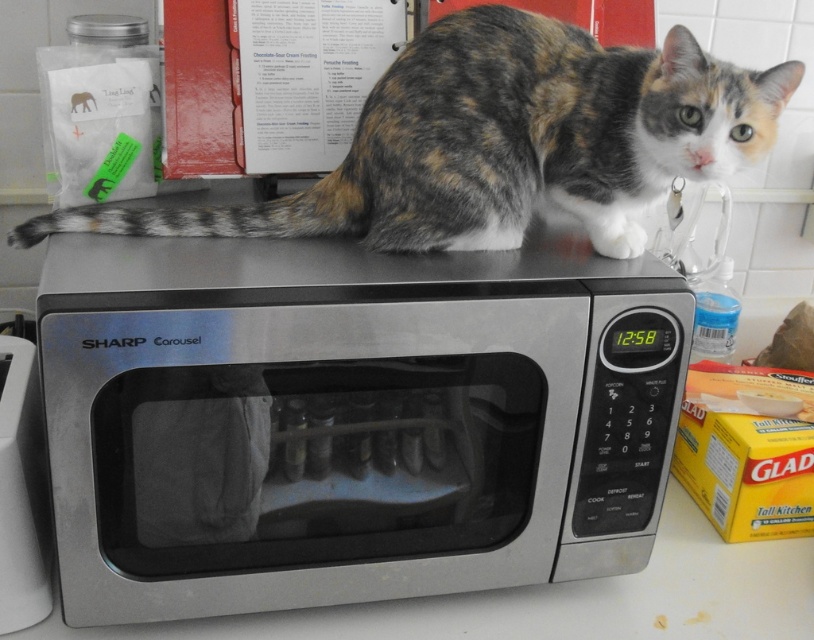
Question: Is satin silver microwave at upper center closer to the viewer compared to calico fur cat at upper center?

Choices:
 (A) yes
 (B) no

Answer: (A)

Question: Does satin silver microwave at upper center have a larger size compared to satin silver microwave at center?

Choices:
 (A) yes
 (B) no

Answer: (A)

Question: Which of the following is the closest to the observer?

Choices:
 (A) (465, 161)
 (B) (77, 452)
 (C) (36, 500)

Answer: (B)

Question: Considering the real-world distances, which object is farthest from the satin silver microwave at center?

Choices:
 (A) satin silver microwave at upper center
 (B) calico fur cat at upper center

Answer: (B)

Question: Which object is the closest to the calico fur cat at upper center?

Choices:
 (A) satin silver microwave at center
 (B) satin silver microwave at upper center

Answer: (B)

Question: In this image, where is satin silver microwave at upper center located relative to satin silver microwave at center?

Choices:
 (A) right
 (B) left

Answer: (A)